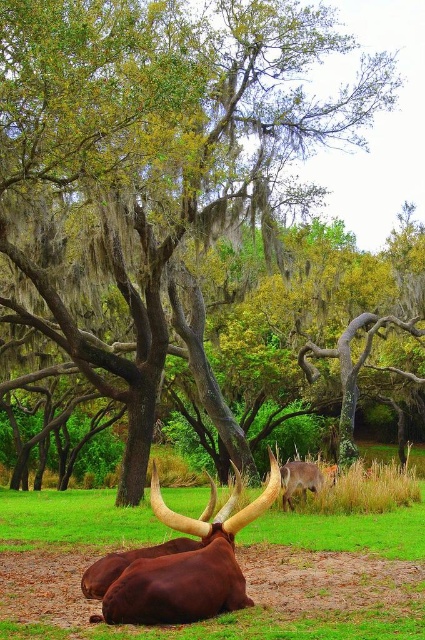
Does brown glossy horned bull at lower center appear on the right side of shiny brown deer at center?

Incorrect, brown glossy horned bull at lower center is not on the right side of shiny brown deer at center.

Can you confirm if brown glossy horned bull at lower center is smaller than shiny brown deer at center?

No, brown glossy horned bull at lower center is not smaller than shiny brown deer at center.

The image size is (425, 640). I want to click on brown glossy horned bull at lower center, so click(x=180, y=564).